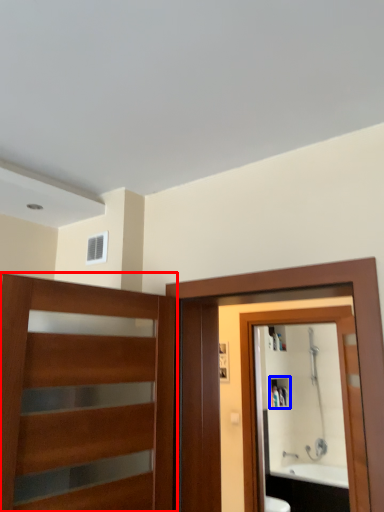
Question: Among these objects, which one is nearest to the camera, door (highlighted by a red box) or cabinet (highlighted by a blue box)?

Choices:
 (A) door
 (B) cabinet

Answer: (A)